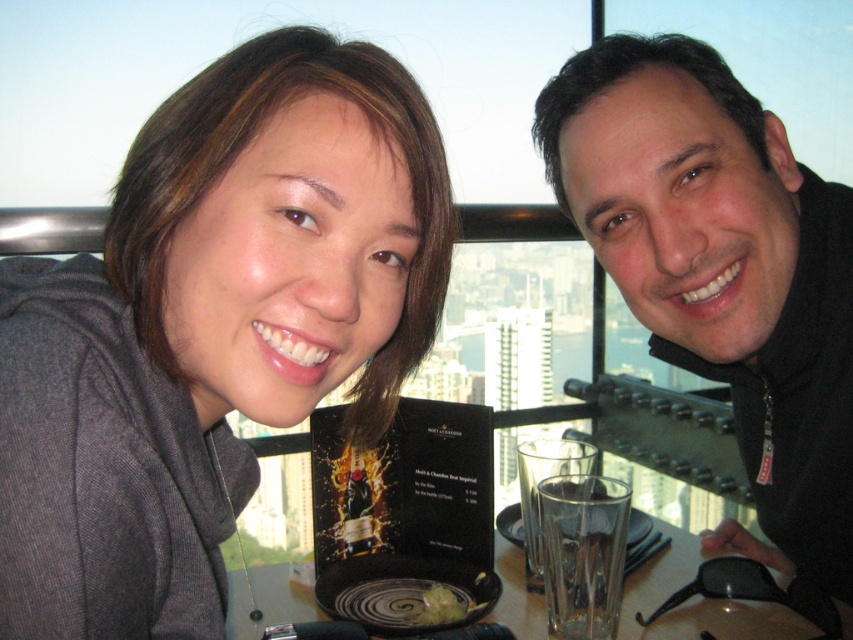
You are a photographer trying to capture a closeup of the menu between the two people. You can only focus on one point at a time. Which point, point (444, 218) or point (289, 620), is closer to you and thus better for focusing on the menu?

Point (444, 218) is closer to the camera than point (289, 620), so focusing on point (444, 218) would be better for capturing a closeup of the menu.

You are a waiter in a high rise restaurant. You need to place a 18 inch long bottle of champagne between the black matte jacket at upper right and the translucent glass at center. Can you fit it there?

The distance between the black matte jacket at upper right and the translucent glass at center is 19.22 inches. Since the bottle is 18 inches long, it can fit in the space between them.